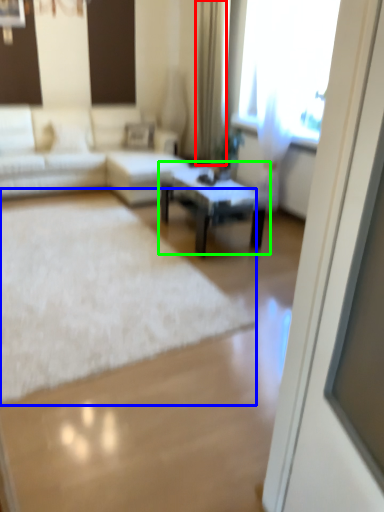
Question: Based on their relative distances, which object is farther from curtain (highlighted by a red box)? Choose from mat (highlighted by a blue box) and coffee table (highlighted by a green box).

Choices:
 (A) mat
 (B) coffee table

Answer: (A)